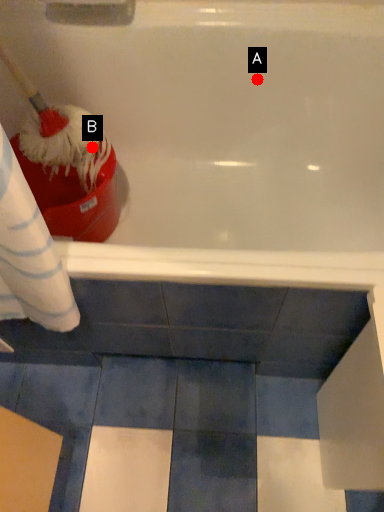
Question: Two points are circled on the image, labeled by A and B beside each circle. Which of the following is the farthest from the observer?

Choices:
 (A) A is further
 (B) B is further

Answer: (A)